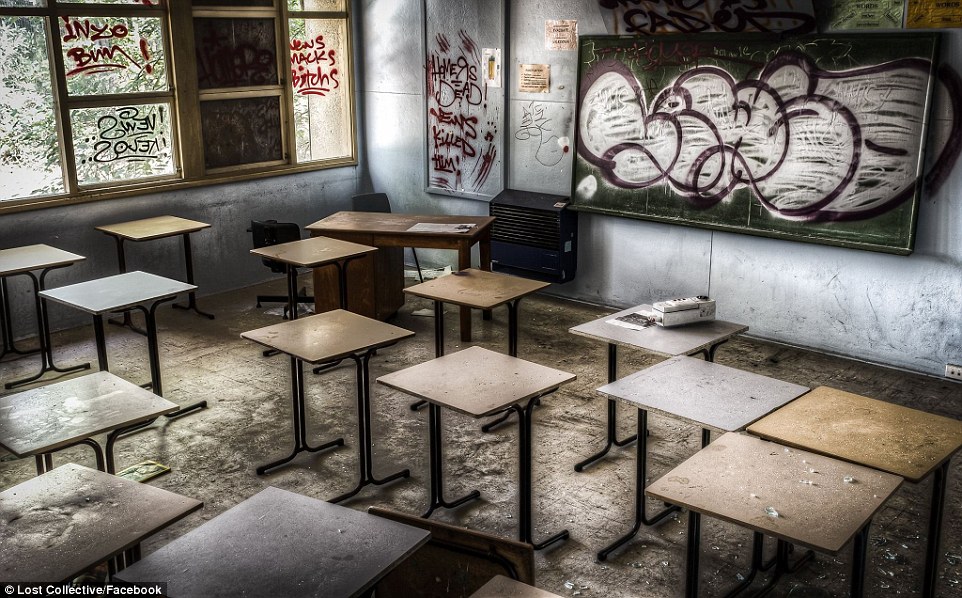
Locate an element on the screen. This screenshot has width=962, height=598. vent is located at coordinates (532, 222).